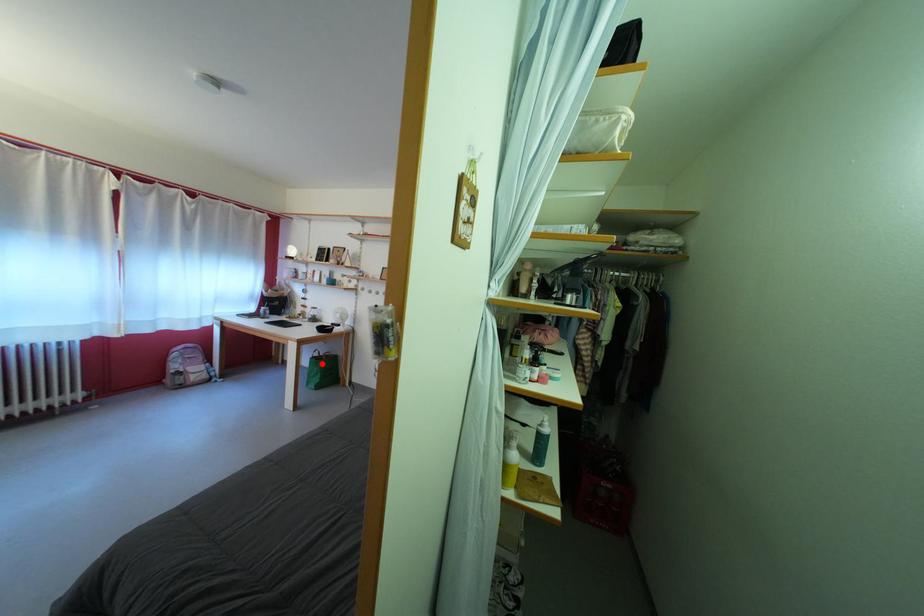
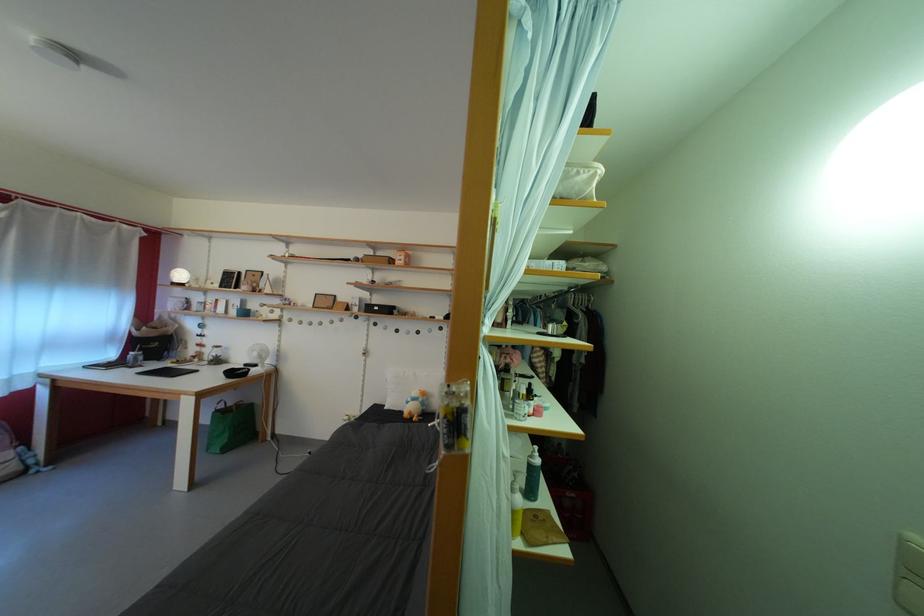
The point at the highlighted location is marked in the first image. Where is the corresponding point in the second image?

(225, 416)